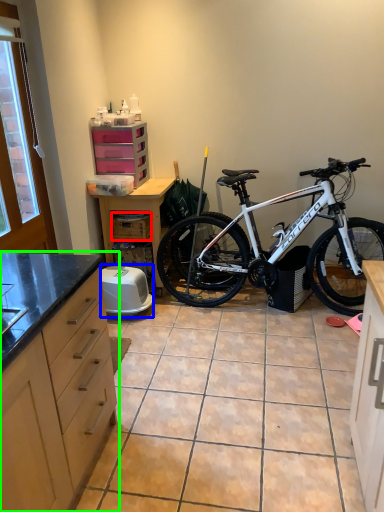
Question: Based on their relative distances, which object is nearer to crate (highlighted by a red box)? Choose from appliance (highlighted by a blue box) and cabinetry (highlighted by a green box).

Choices:
 (A) appliance
 (B) cabinetry

Answer: (A)